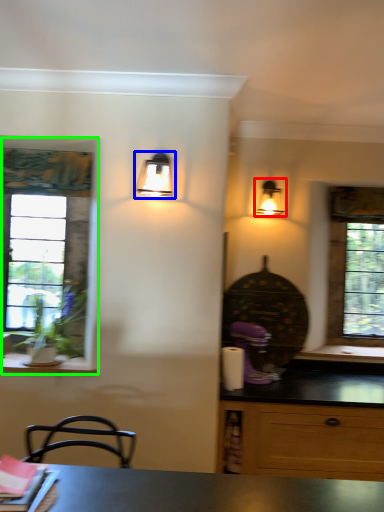
Question: Estimate the real-world distances between objects in this image. Which object is closer to lamp (highlighted by a red box), lamp (highlighted by a blue box) or window (highlighted by a green box)?

Choices:
 (A) lamp
 (B) window

Answer: (A)